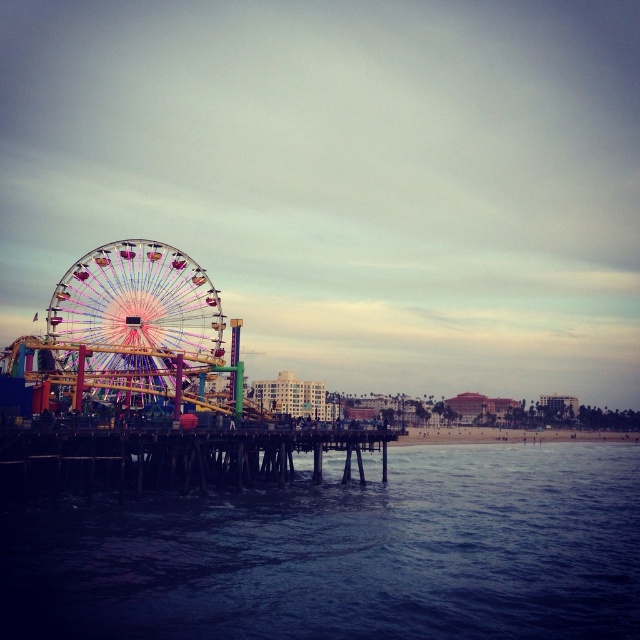
Locate an element on the screen. The image size is (640, 640). dark blue water at lower center is located at coordinates (346, 554).

Between dark blue water at lower center and multicolored metallic ferris wheel at left, which one is positioned lower?

dark blue water at lower center is lower down.

Between point (170, 605) and point (83, 312), which one is positioned in front?

Point (170, 605) is in front.

Locate an element on the screen. This screenshot has height=640, width=640. dark blue water at lower center is located at coordinates (346, 554).

Identify the location of wooden at center. (170, 458).

Does wooden at center have a larger size compared to sandy beach at lower center?

Yes, wooden at center is bigger than sandy beach at lower center.

Locate an element on the screen. wooden at center is located at coordinates (170, 458).

Can you confirm if multicolored metallic ferris wheel at left is positioned below sandy beach at lower center?

No, multicolored metallic ferris wheel at left is not below sandy beach at lower center.

Which is more to the right, multicolored metallic ferris wheel at left or sandy beach at lower center?

sandy beach at lower center is more to the right.

Consider the image. Who is more forward, (84, 280) or (588, 436)?

Positioned in front is point (84, 280).

This screenshot has width=640, height=640. I want to click on multicolored metallic ferris wheel at left, so (x=136, y=320).